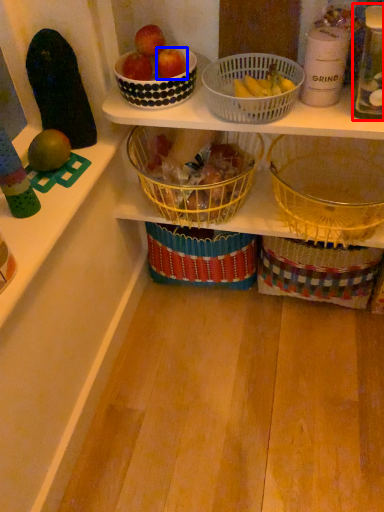
Question: Among these objects, which one is farthest to the camera, bottle (highlighted by a red box) or apple (highlighted by a blue box)?

Choices:
 (A) bottle
 (B) apple

Answer: (B)